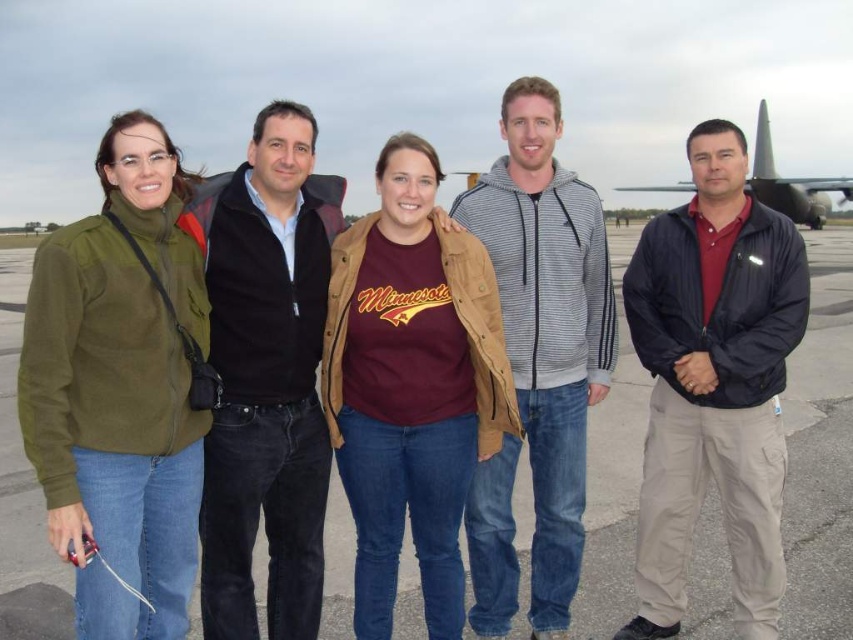
Is point (706, 266) behind point (38, 595)?

No.

Can you confirm if dark blue jacket at right is positioned to the left of gray asphalt tarmac at center?

Indeed, dark blue jacket at right is positioned on the left side of gray asphalt tarmac at center.

This screenshot has height=640, width=853. In order to click on dark blue jacket at right in this screenshot , I will do `click(714, 381)`.

This screenshot has height=640, width=853. Identify the location of dark blue jacket at right. (714, 381).

Does dark blue jacket at right have a lesser height compared to black fleece jacket at center?

Yes, dark blue jacket at right is shorter than black fleece jacket at center.

At what (x,y) coordinates should I click in order to perform the action: click on dark blue jacket at right. Please return your answer as a coordinate pair (x, y). Image resolution: width=853 pixels, height=640 pixels. Looking at the image, I should click on (714, 381).

Identify the location of dark blue jacket at right. (714, 381).

Does black fleece jacket at center have a lesser height compared to striped hoodie at center?

Correct, black fleece jacket at center is not as tall as striped hoodie at center.

This screenshot has width=853, height=640. What do you see at coordinates (265, 376) in the screenshot?
I see `black fleece jacket at center` at bounding box center [265, 376].

Describe the element at coordinates (265, 376) in the screenshot. The width and height of the screenshot is (853, 640). I see `black fleece jacket at center` at that location.

Locate an element on the screen. The width and height of the screenshot is (853, 640). black fleece jacket at center is located at coordinates (265, 376).